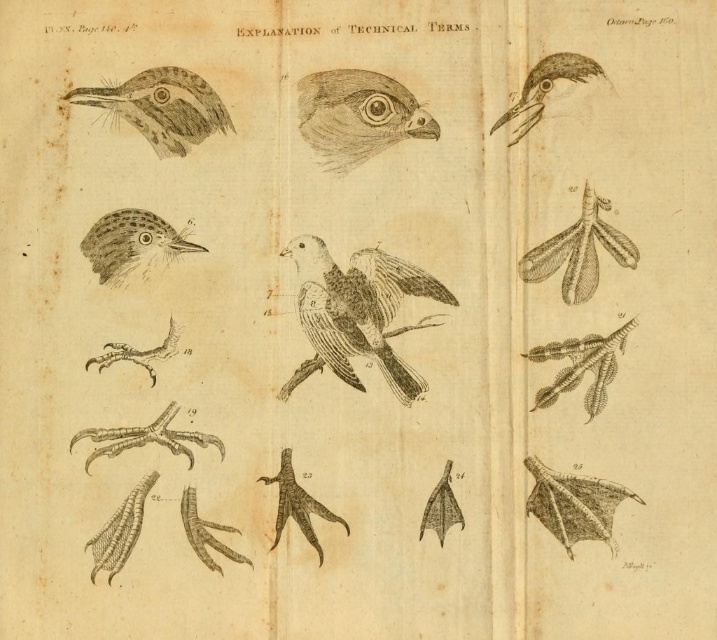
Is etched paper bird at upper left smaller than speckled feathered bird head at center-left?

No, etched paper bird at upper left is not smaller than speckled feathered bird head at center-left.

Is point (217, 129) positioned behind point (105, 234)?

Yes.

Describe the element at coordinates (161, 108) in the screenshot. I see `etched paper bird at upper left` at that location.

Image resolution: width=717 pixels, height=640 pixels. What are the coordinates of `etched paper bird at upper left` in the screenshot? It's located at (161, 108).

Can you confirm if brown speckled bird at center is bigger than speckled feathered bird head at center-left?

Yes, brown speckled bird at center is bigger than speckled feathered bird head at center-left.

Is brown speckled bird at center to the right of speckled feathered bird head at center-left from the viewer's perspective?

Correct, you'll find brown speckled bird at center to the right of speckled feathered bird head at center-left.

Is point (338, 314) positioned in front of point (141, 244)?

No, it is not.

Where is `brown speckled bird at center`? brown speckled bird at center is located at coordinates (356, 312).

Between etched paper bird head at center and etched paper bird at upper left, which one appears on the left side from the viewer's perspective?

Positioned to the left is etched paper bird at upper left.

In the scene shown: Is etched paper bird head at center to the left of etched paper bird at upper left from the viewer's perspective?

No, etched paper bird head at center is not to the left of etched paper bird at upper left.

Image resolution: width=717 pixels, height=640 pixels. Identify the location of etched paper bird head at center. (356, 115).